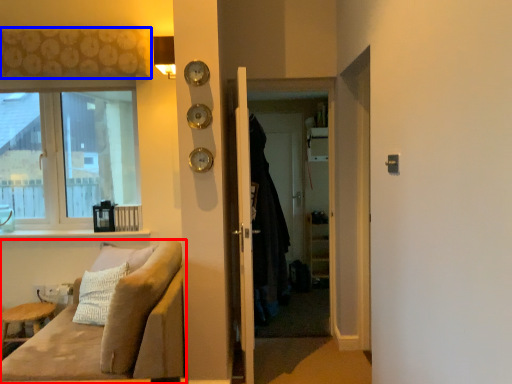
Question: Among these objects, which one is farthest to the camera, studio couch (highlighted by a red box) or curtain (highlighted by a blue box)?

Choices:
 (A) studio couch
 (B) curtain

Answer: (B)